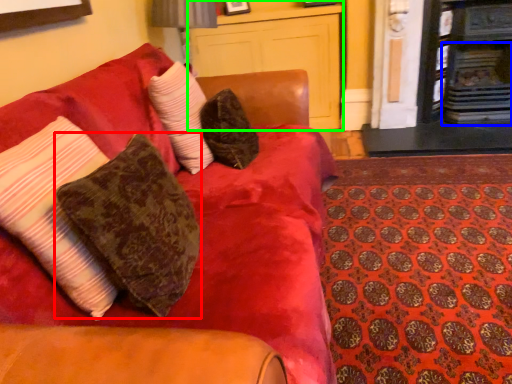
Question: Which object is positioned closest to pillow (highlighted by a red box)? Select from fireplace (highlighted by a blue box) and dresser (highlighted by a green box).

Choices:
 (A) fireplace
 (B) dresser

Answer: (B)